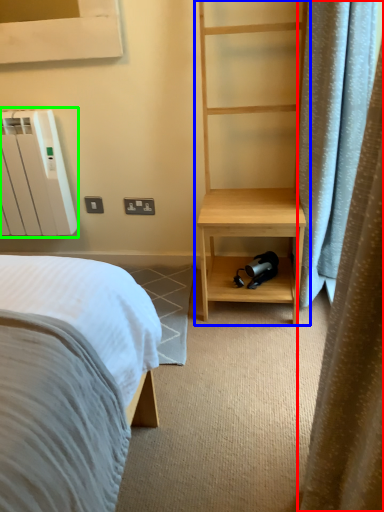
Question: Which object is positioned closest to curtain (highlighted by a red box)? Select from bookshelf (highlighted by a blue box) and radiator (highlighted by a green box).

Choices:
 (A) bookshelf
 (B) radiator

Answer: (A)